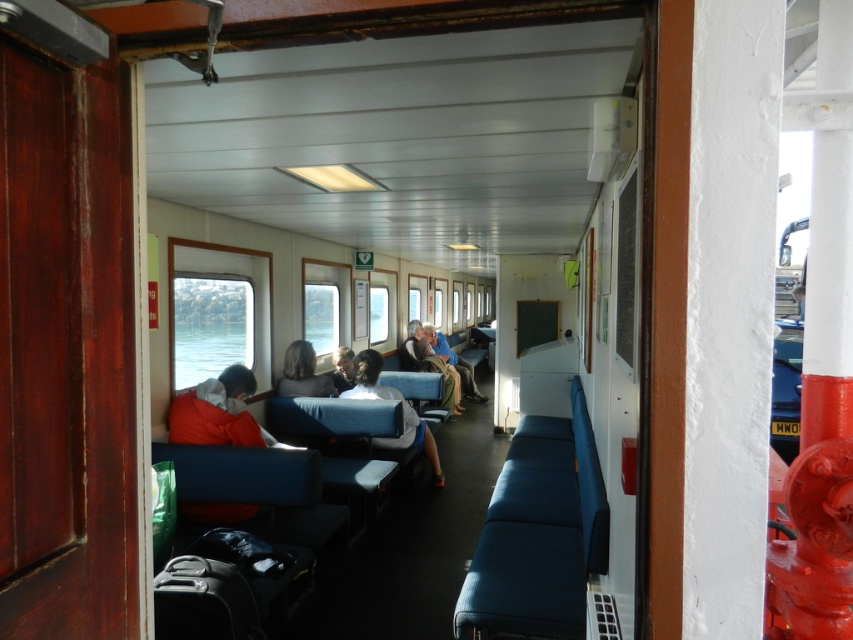
Which is above, gray fabric jacket at center or light brown leather jacket at center?

gray fabric jacket at center is above.

Can you confirm if gray fabric jacket at center is taller than light brown leather jacket at center?

No, gray fabric jacket at center is not taller than light brown leather jacket at center.

The width and height of the screenshot is (853, 640). What are the coordinates of `gray fabric jacket at center` in the screenshot? It's located at (302, 372).

Can you confirm if blue fabric jacket at center is thinner than smooth gray shirt at center?

No.

Is blue fabric jacket at center bigger than smooth gray shirt at center?

Yes, blue fabric jacket at center is bigger than smooth gray shirt at center.

The width and height of the screenshot is (853, 640). What do you see at coordinates (451, 362) in the screenshot?
I see `blue fabric jacket at center` at bounding box center [451, 362].

I want to click on blue fabric jacket at center, so click(x=451, y=362).

Which of these two, gray fabric jacket at center or blue fabric jacket at center, stands taller?

blue fabric jacket at center

Is point (306, 365) more distant than point (457, 356)?

No.

In order to click on gray fabric jacket at center in this screenshot , I will do `click(302, 372)`.